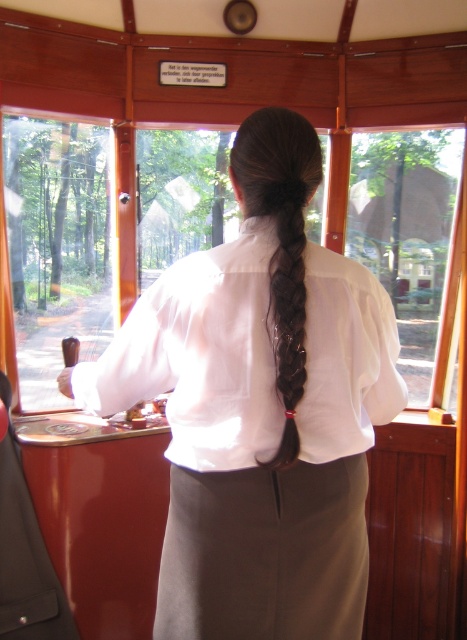
Can you confirm if transparent glass window at left is thinner than transparent glass window at center?

Correct, transparent glass window at left's width is less than transparent glass window at center's.

Which is in front, point (25, 161) or point (402, 232)?

Positioned in front is point (25, 161).

Between point (61, 403) and point (380, 189), which one is positioned in front?

Positioned in front is point (61, 403).

Identify the location of transparent glass window at left. (56, 246).

Which is more to the right, brown silky hair braid at center back or brown silky hair at center back?

Positioned to the right is brown silky hair at center back.

Does brown silky hair braid at center back have a greater width compared to brown silky hair at center back?

Yes.

Image resolution: width=467 pixels, height=640 pixels. What do you see at coordinates (281, 241) in the screenshot? I see `brown silky hair braid at center back` at bounding box center [281, 241].

This screenshot has height=640, width=467. What are the coordinates of `brown silky hair braid at center back` in the screenshot? It's located at (281, 241).

Is white smooth shirt at center shorter than transparent glass window at center?

Yes, white smooth shirt at center is shorter than transparent glass window at center.

Is white smooth shirt at center closer to the viewer compared to transparent glass window at center?

Yes, it is.

Is point (167, 449) less distant than point (438, 272)?

Yes, it is.

At what (x,y) coordinates should I click in order to perform the action: click on white smooth shirt at center. Please return your answer as a coordinate pair (x, y). The width and height of the screenshot is (467, 640). Looking at the image, I should click on (199, 355).